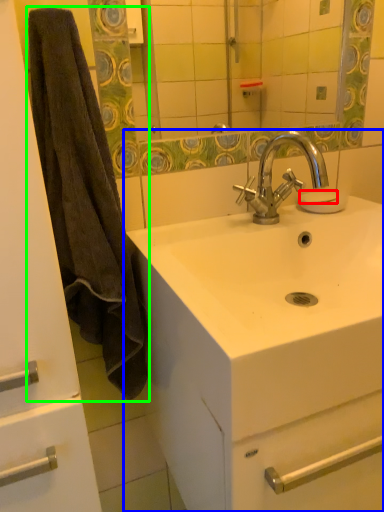
Question: Based on their relative distances, which object is farther from soap (highlighted by a red box)? Choose from sink (highlighted by a blue box) and bath towel (highlighted by a green box).

Choices:
 (A) sink
 (B) bath towel

Answer: (B)